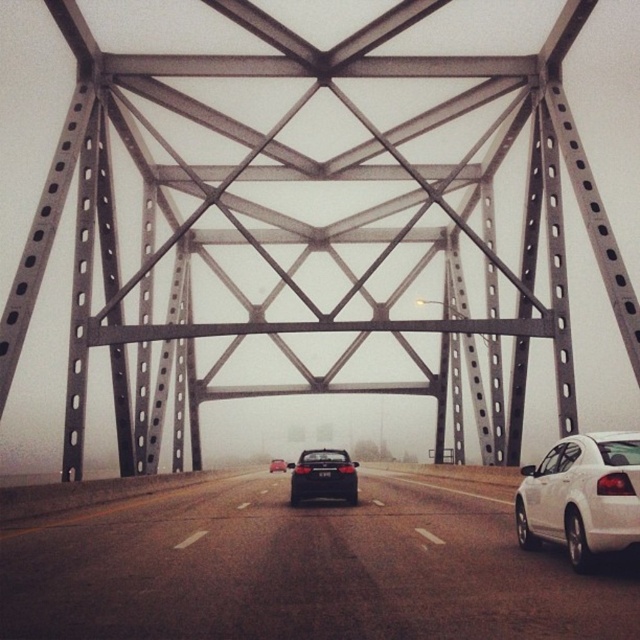
Question: Does matte black sedan at center appear under shiny black sedan at center?

Choices:
 (A) yes
 (B) no

Answer: (B)

Question: Is the position of white glossy sedan at right less distant than that of matte black sedan at center?

Choices:
 (A) yes
 (B) no

Answer: (A)

Question: Which object is the closest to the shiny black sedan at center?

Choices:
 (A) matte black sedan at center
 (B) black plastic license plate at center
 (C) white glossy sedan at right

Answer: (A)

Question: Which object is positioned closest to the matte black sedan at center?

Choices:
 (A) shiny black sedan at center
 (B) white glossy sedan at right
 (C) black plastic license plate at center
 (D) smooth asphalt highway at center

Answer: (C)

Question: Among these objects, which one is farthest from the camera?

Choices:
 (A) shiny black sedan at center
 (B) black plastic license plate at center
 (C) matte black sedan at center

Answer: (A)

Question: Can you confirm if white glossy sedan at right is bigger than black plastic license plate at center?

Choices:
 (A) no
 (B) yes

Answer: (B)